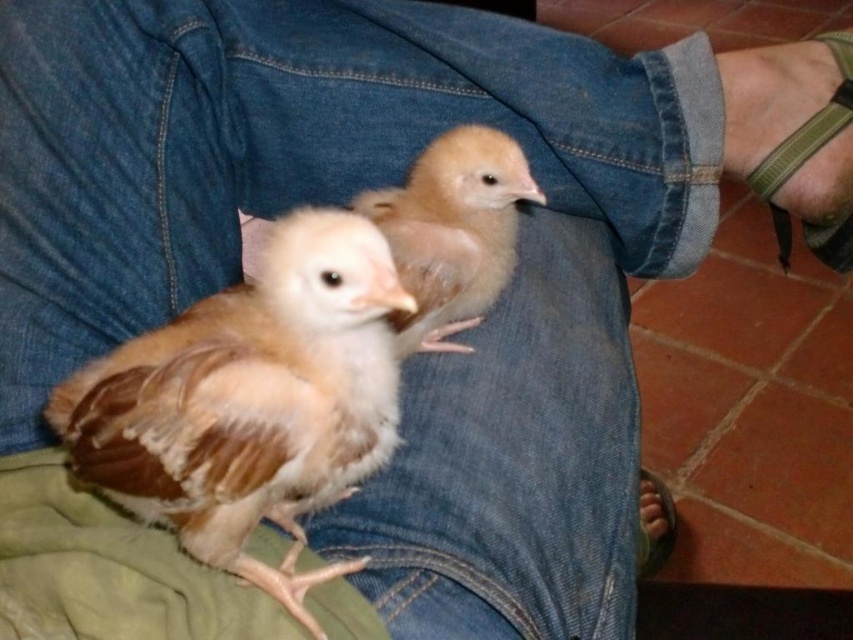
Is light brown fluffy chick at center shorter than brown leather foot at lower right?

In fact, light brown fluffy chick at center may be taller than brown leather foot at lower right.

Who is more distant from viewer, (363, 208) or (668, 532)?

Positioned behind is point (668, 532).

Is point (466, 264) farther from viewer compared to point (646, 531)?

No.

Locate an element on the screen. light brown fluffy chick at center is located at coordinates (453, 227).

Is brown fluffy chick at center in front of green fabric strap at lower right?

Yes, it is in front of green fabric strap at lower right.

Who is shorter, brown fluffy chick at center or green fabric strap at lower right?

Standing shorter between the two is brown fluffy chick at center.

Does point (270, 323) come farther from viewer compared to point (840, 76)?

No, (270, 323) is in front of (840, 76).

This screenshot has height=640, width=853. What are the coordinates of `brown fluffy chick at center` in the screenshot? It's located at (252, 401).

Who is positioned more to the left, brown fluffy chick at center or brown leather foot at lower right?

Positioned to the left is brown fluffy chick at center.

Who is more distant from viewer, (234, 481) or (653, 474)?

The point (653, 474) is behind.

Does point (338, 564) lie behind point (648, 564)?

No, it is not.

At what (x,y) coordinates should I click in order to perform the action: click on brown fluffy chick at center. Please return your answer as a coordinate pair (x, y). The width and height of the screenshot is (853, 640). Looking at the image, I should click on (252, 401).